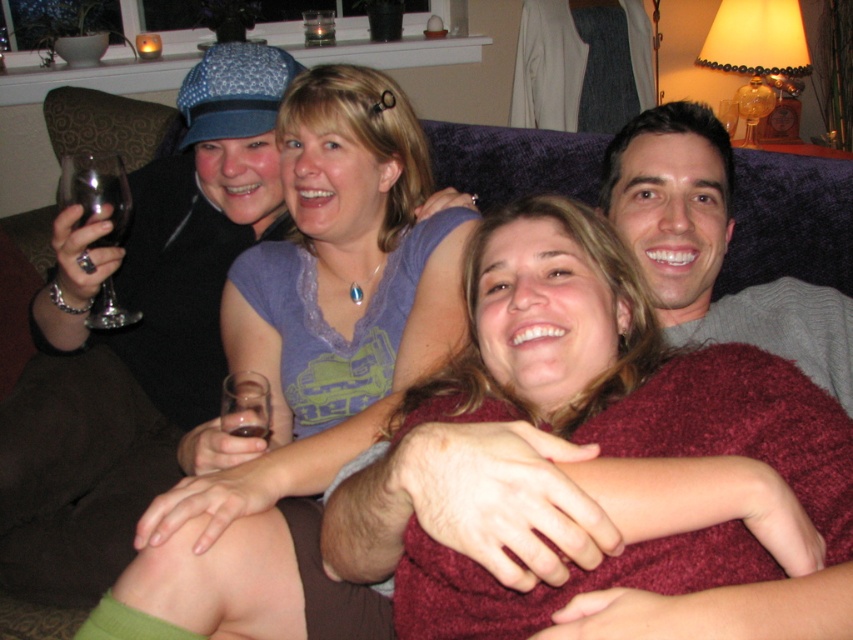
Is point (241, 419) positioned after point (726, 108)?

No, (241, 419) is closer to viewer.

Can you confirm if translucent glass wine at center is smaller than transparent plastic wine glass at upper center?

Yes, translucent glass wine at center is smaller than transparent plastic wine glass at upper center.

Locate an element on the screen. The width and height of the screenshot is (853, 640). translucent glass wine at center is located at coordinates (250, 429).

Which is more to the left, transparent plastic wine glass at lower center or translucent glass wine at center?

transparent plastic wine glass at lower center

Does transparent plastic wine glass at lower center lie behind translucent glass wine at center?

No, transparent plastic wine glass at lower center is closer to the viewer.

Describe the element at coordinates (245, 404) in the screenshot. The width and height of the screenshot is (853, 640). I see `transparent plastic wine glass at lower center` at that location.

Image resolution: width=853 pixels, height=640 pixels. In order to click on transparent plastic wine glass at lower center in this screenshot , I will do `click(245, 404)`.

Which of these two, transparent glass wine glass at left or translucent glass wine at center, stands taller?

transparent glass wine glass at left

Looking at this image, is transparent glass wine glass at left taller than translucent glass wine at center?

Correct, transparent glass wine glass at left is much taller as translucent glass wine at center.

This screenshot has width=853, height=640. Describe the element at coordinates (96, 192) in the screenshot. I see `transparent glass wine glass at left` at that location.

Find the location of a particular element. The height and width of the screenshot is (640, 853). transparent glass wine glass at left is located at coordinates (96, 192).